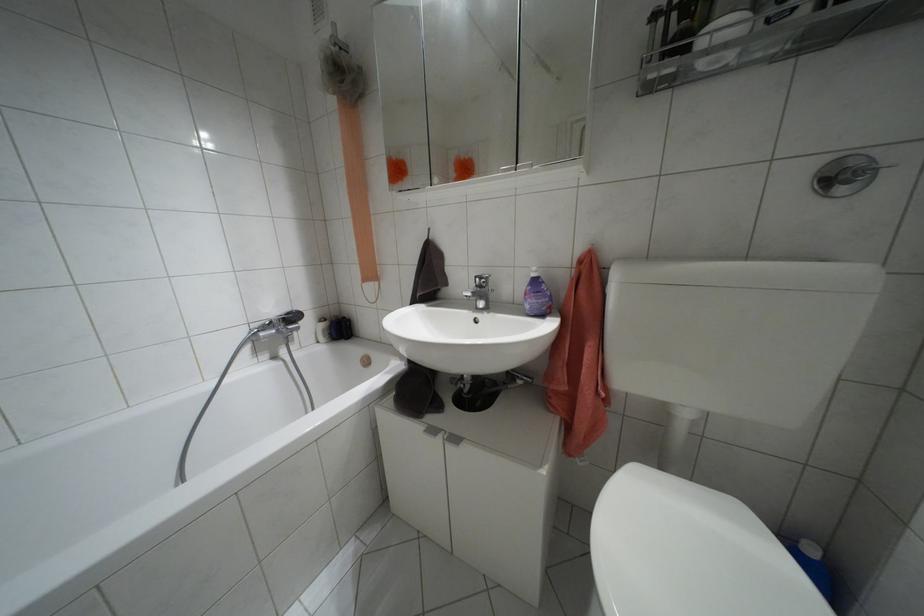
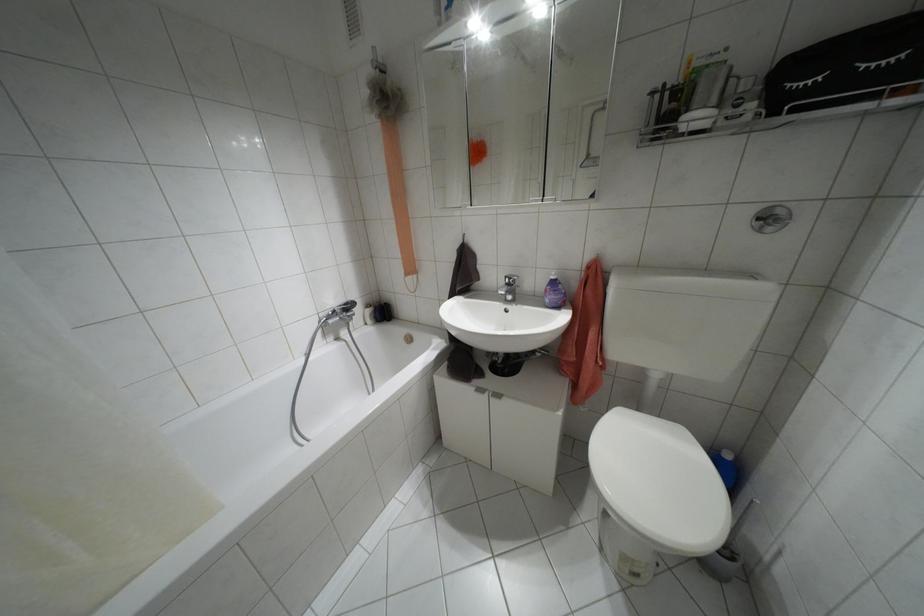
The point at [479,286] is marked in the first image. Where is the corresponding point in the second image?

(507, 284)